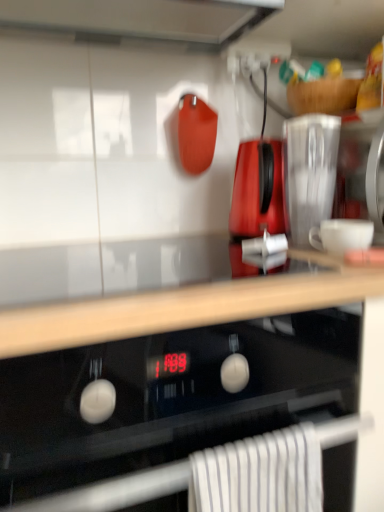
Question: Looking at their shapes, would you say black glass oven at center is wider or thinner than translucent plastic blender at center, the first kitchen appliance when ordered from right to left?

Choices:
 (A) wide
 (B) thin

Answer: (A)

Question: In terms of height, does black glass oven at center look taller or shorter compared to translucent plastic blender at center, the first kitchen appliance when ordered from right to left?

Choices:
 (A) tall
 (B) short

Answer: (A)

Question: Estimate the real-world distances between objects in this image. Which object is farther from the black glass oven at center?

Choices:
 (A) translucent plastic blender at center, which is the 2th kitchen appliance in left-to-right order
 (B) wooden at upper center
 (C) white striped towel at lower center
 (D) glossy plastic kettle at center, which ranks as the first kitchen appliance in left-to-right order

Answer: (D)

Question: Which is nearer to the black glass oven at center?

Choices:
 (A) translucent plastic blender at center, which is the 2th kitchen appliance in left-to-right order
 (B) white striped towel at lower center
 (C) wooden at upper center
 (D) glossy plastic kettle at center, arranged as the 2th kitchen appliance when viewed from the right

Answer: (B)